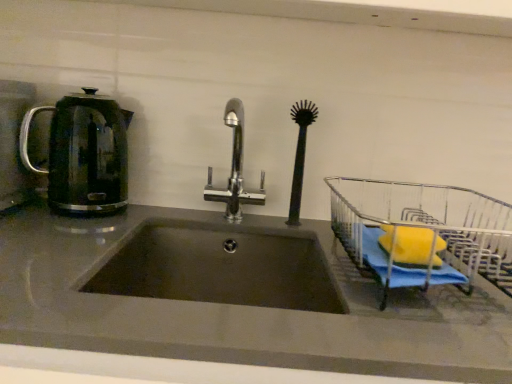
Question: Is translucent glass kettle at left situated inside dark gray matte sink at center or outside?

Choices:
 (A) inside
 (B) outside

Answer: (B)

Question: Is translucent glass kettle at left wider or thinner than dark gray matte sink at center?

Choices:
 (A) thin
 (B) wide

Answer: (A)

Question: Which object is the farthest from the translucent glass kettle at left?

Choices:
 (A) chrome metallic faucet at center
 (B) dark gray matte sink at center
 (C) metallic wire dish rack at right
 (D) black rubber brush at center

Answer: (C)

Question: Which of these objects is positioned farthest from the metallic wire dish rack at right?

Choices:
 (A) black rubber brush at center
 (B) chrome metallic faucet at center
 (C) dark gray matte sink at center
 (D) translucent glass kettle at left

Answer: (D)